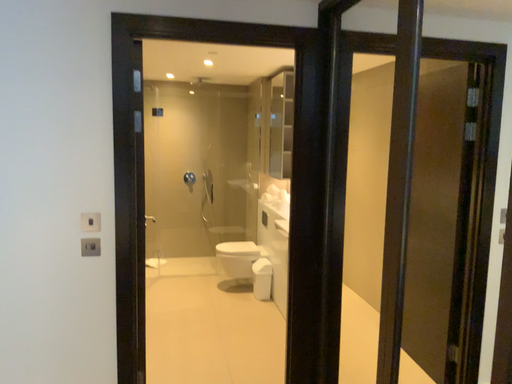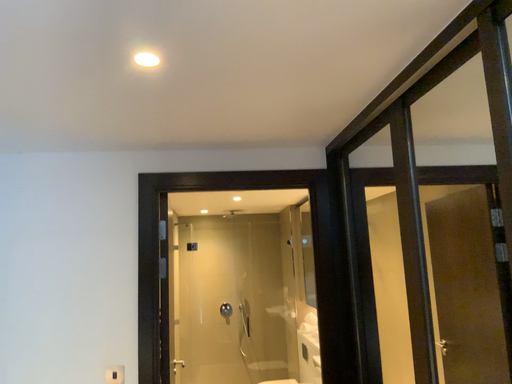
Question: How did the camera likely rotate when shooting the video?

Choices:
 (A) rotated right
 (B) rotated left

Answer: (B)